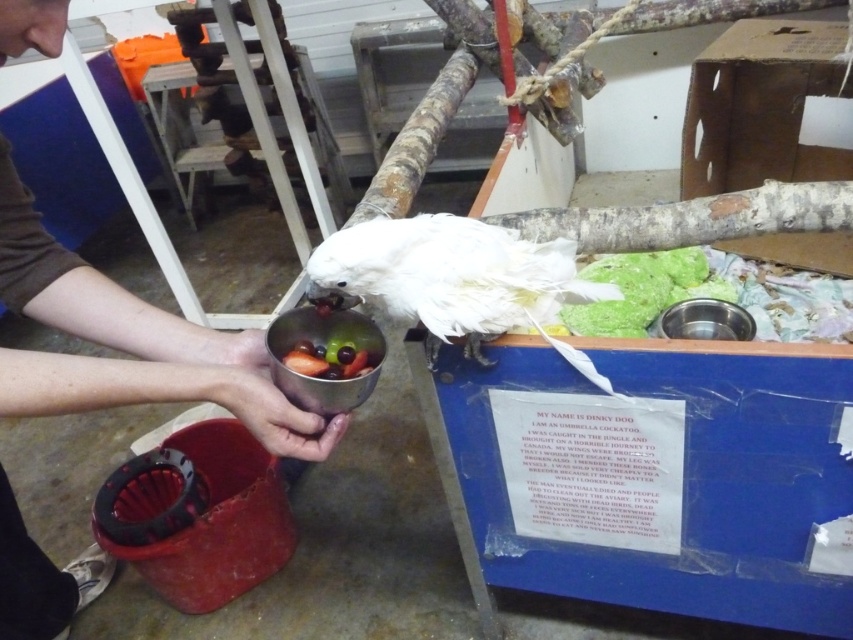
Who is lower down, white feathered bird at center or metallic silver bowl at center?

metallic silver bowl at center is below.

Can you confirm if white feathered bird at center is shorter than metallic silver bowl at center?

No.

Where is `white feathered bird at center`? Image resolution: width=853 pixels, height=640 pixels. white feathered bird at center is located at coordinates (451, 276).

Which is in front, point (553, 280) or point (276, 433)?

Point (276, 433)

Is white feathered bird at center bigger than matte silver cup at lower center?

Indeed, white feathered bird at center has a larger size compared to matte silver cup at lower center.

Measure the distance between white feathered bird at center and camera.

28.03 inches

Identify the location of white feathered bird at center. (451, 276).

Between smooth skin hand at lower left and metallic silver bowl at center, which one has more height?

Standing taller between the two is smooth skin hand at lower left.

Between point (119, 296) and point (292, 332), which one is positioned in front?

Positioned in front is point (292, 332).

The width and height of the screenshot is (853, 640). Describe the element at coordinates (128, 342) in the screenshot. I see `smooth skin hand at lower left` at that location.

At what (x,y) coordinates should I click in order to perform the action: click on smooth skin hand at lower left. Please return your answer as a coordinate pair (x, y). Looking at the image, I should click on (128, 342).